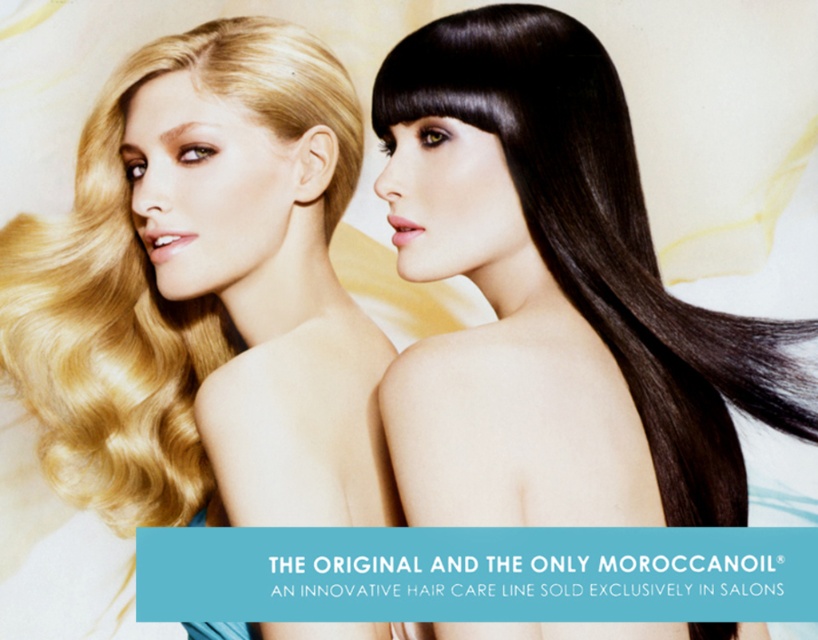
Between shiny dark brown hair at center and shiny blonde hair at left, which one is positioned higher?

shiny blonde hair at left is higher up.

Which is behind, point (533, 250) or point (204, 301)?

The point (204, 301) is more distant.

Between point (686, 342) and point (75, 289), which one is positioned in front?

Positioned in front is point (686, 342).

Locate an element on the screen. This screenshot has width=818, height=640. shiny dark brown hair at center is located at coordinates (554, 298).